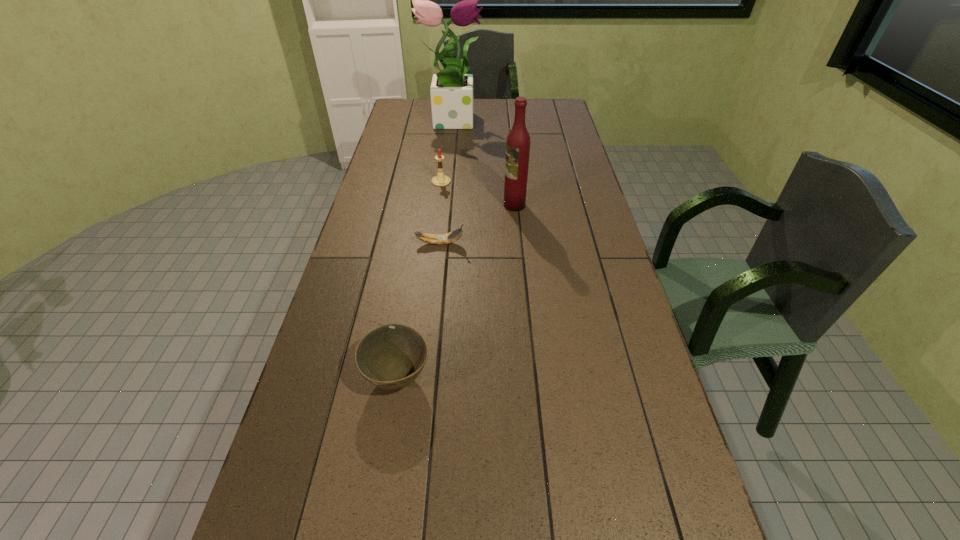
Where is `vacant space situated on the front-facing side of the farthest object`? The height and width of the screenshot is (540, 960). vacant space situated on the front-facing side of the farthest object is located at coordinates (553, 119).

Where is `free region located 0.270m on the label of the fourth shortest object`? The image size is (960, 540). free region located 0.270m on the label of the fourth shortest object is located at coordinates [429, 205].

At what (x,y) coordinates should I click in order to perform the action: click on vacant space located on the label of the fourth shortest object. Please return your answer as a coordinate pair (x, y). This screenshot has height=540, width=960. Looking at the image, I should click on (459, 205).

What are the coordinates of `free space located on the label of the fourth shortest object` in the screenshot? It's located at (440, 205).

Locate an element on the screen. vacant space located on the right of the third tallest object is located at coordinates (546, 181).

The width and height of the screenshot is (960, 540). Find the location of `vacant space positioned on the back of the nearest object`. vacant space positioned on the back of the nearest object is located at coordinates (415, 268).

Find the location of `vacant space located 0.080m at the stem of the banana`. vacant space located 0.080m at the stem of the banana is located at coordinates (490, 244).

The image size is (960, 540). Identify the location of object positioned at the far edge. (451, 91).

At what (x,y) coordinates should I click in order to perform the action: click on flower arrangement at the left edge. Please return your answer as a coordinate pair (x, y). The height and width of the screenshot is (540, 960). Looking at the image, I should click on (451, 91).

You are a GUI agent. You are given a task and a screenshot of the screen. Output one action in this format:
    pyautogui.click(x=<x>, y=<y>)
    Task: Click on the bowl that is at the left edge
    
    Given the screenshot: What is the action you would take?
    pyautogui.click(x=391, y=356)